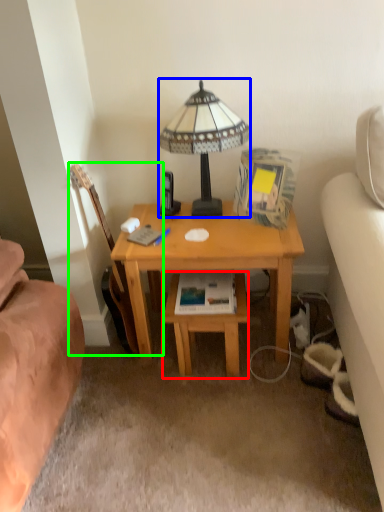
Question: Which is farther away from table (highlighted by a red box)? lamp (highlighted by a blue box) or guitar (highlighted by a green box)?

Choices:
 (A) lamp
 (B) guitar

Answer: (A)